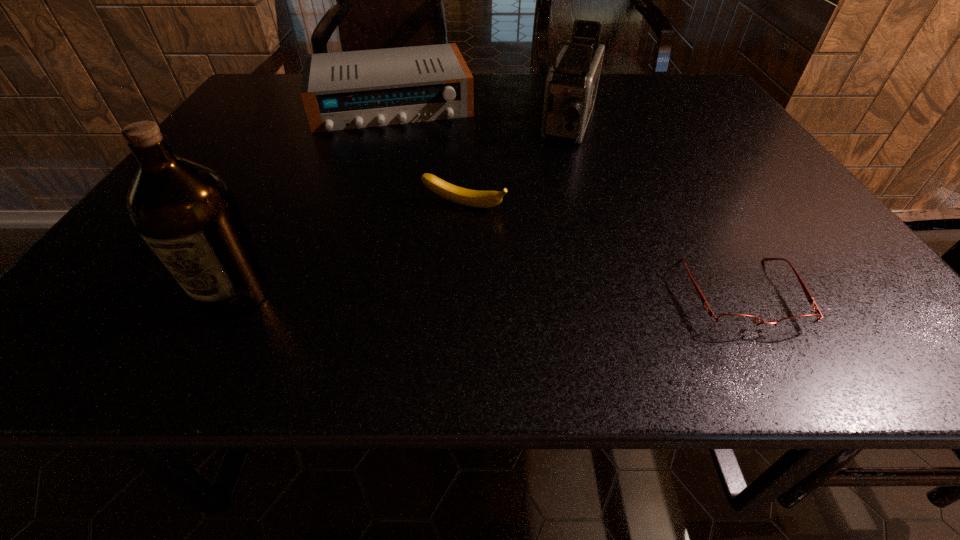
Find the location of `vacant space on the desktop that is between the tallest object and the rightmost object and is positioned at the lens of the second object from right to left`. vacant space on the desktop that is between the tallest object and the rightmost object and is positioned at the lens of the second object from right to left is located at coordinates (503, 294).

At what (x,y) coordinates should I click in order to perform the action: click on vacant space on the desktop that is between the olive oil and the spectacles and is positioned on the control panel of the third shortest object. Please return your answer as a coordinate pair (x, y). This screenshot has width=960, height=540. Looking at the image, I should click on (425, 294).

In order to click on free space on the desktop that is between the olive oil and the shortest object and is positioned at the stem of the banana in this screenshot , I will do `click(422, 294)`.